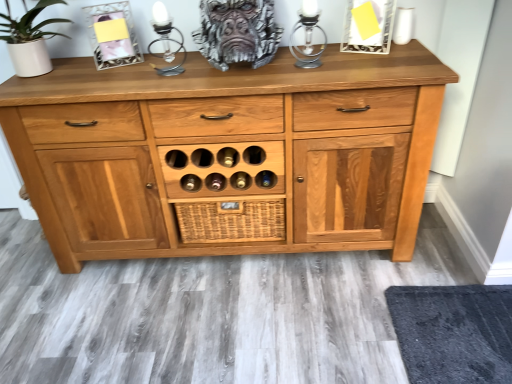
Locate an element on the screen. empty space that is ontop of black textured mat at lower right (from a real-world perspective) is located at coordinates (466, 321).